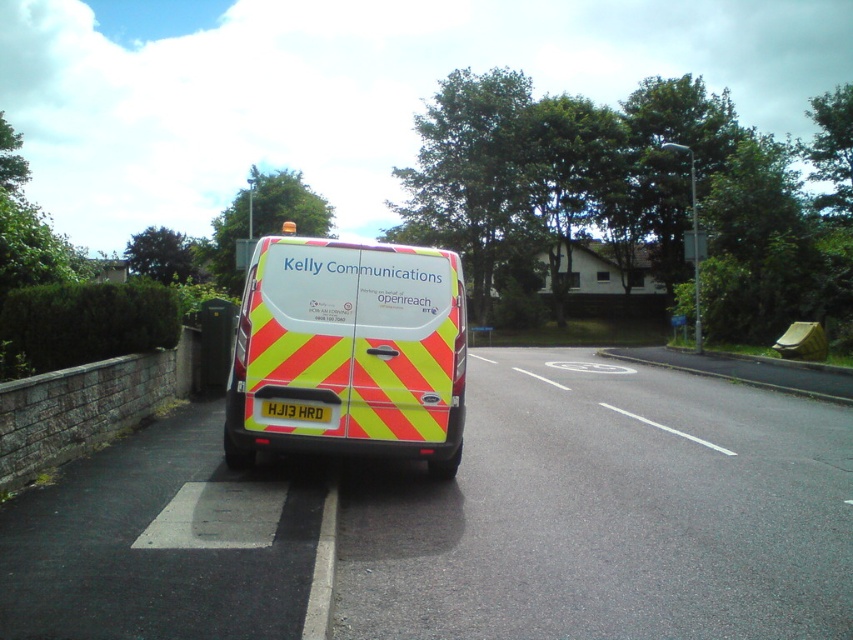
Can you confirm if reflective yellow and red van at center is positioned to the right of white plastic license plate at rear?

Indeed, reflective yellow and red van at center is positioned on the right side of white plastic license plate at rear.

You are a GUI agent. You are given a task and a screenshot of the screen. Output one action in this format:
    pyautogui.click(x=<x>, y=<y>)
    Task: Click on the reflective yellow and red van at center
    
    Given the screenshot: What is the action you would take?
    349,352